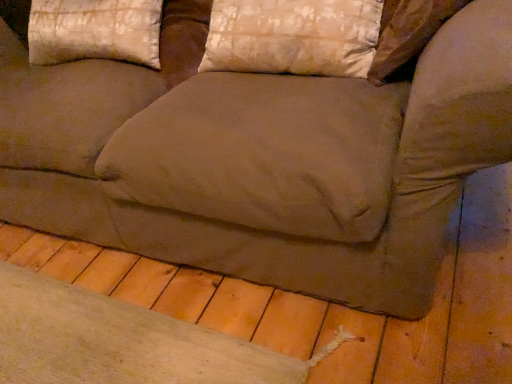
Question: Can you confirm if silky beige pillow at upper center, positioned as the first pillow in right-to-left order, is positioned to the left of silky beige pillow at upper left, arranged as the 2th pillow when viewed from the right?

Choices:
 (A) yes
 (B) no

Answer: (B)

Question: Considering the relative sizes of silky beige pillow at upper center, positioned as the first pillow in right-to-left order, and silky beige pillow at upper left, positioned as the 1th pillow in left-to-right order, in the image provided, is silky beige pillow at upper center, positioned as the first pillow in right-to-left order, shorter than silky beige pillow at upper left, positioned as the 1th pillow in left-to-right order,?

Choices:
 (A) no
 (B) yes

Answer: (B)

Question: Is silky beige pillow at upper center, which is the second pillow from left to right, behind silky beige pillow at upper left, arranged as the 2th pillow when viewed from the right?

Choices:
 (A) no
 (B) yes

Answer: (A)

Question: From a real-world perspective, is silky beige pillow at upper center, positioned as the first pillow in right-to-left order, located beneath silky beige pillow at upper left, arranged as the 2th pillow when viewed from the right?

Choices:
 (A) no
 (B) yes

Answer: (B)

Question: Could you tell me if silky beige pillow at upper center, which is the second pillow from left to right, is facing silky beige pillow at upper left, positioned as the 1th pillow in left-to-right order?

Choices:
 (A) yes
 (B) no

Answer: (B)

Question: Is silky beige pillow at upper center, which is the second pillow from left to right, looking in the opposite direction of silky beige pillow at upper left, arranged as the 2th pillow when viewed from the right?

Choices:
 (A) yes
 (B) no

Answer: (B)

Question: Considering the relative sizes of silky beige pillow at upper left, arranged as the 2th pillow when viewed from the right, and silky beige pillow at upper center, which is the second pillow from left to right, in the image provided, is silky beige pillow at upper left, arranged as the 2th pillow when viewed from the right, smaller than silky beige pillow at upper center, which is the second pillow from left to right,?

Choices:
 (A) yes
 (B) no

Answer: (B)

Question: Is silky beige pillow at upper left, positioned as the 1th pillow in left-to-right order, oriented away from silky beige pillow at upper center, which is the second pillow from left to right?

Choices:
 (A) yes
 (B) no

Answer: (B)

Question: Considering the relative sizes of silky beige pillow at upper left, positioned as the 1th pillow in left-to-right order, and silky beige pillow at upper center, positioned as the first pillow in right-to-left order, in the image provided, is silky beige pillow at upper left, positioned as the 1th pillow in left-to-right order, wider than silky beige pillow at upper center, positioned as the first pillow in right-to-left order,?

Choices:
 (A) no
 (B) yes

Answer: (B)

Question: Could you tell me if silky beige pillow at upper left, arranged as the 2th pillow when viewed from the right, is turned towards silky beige pillow at upper center, positioned as the first pillow in right-to-left order?

Choices:
 (A) yes
 (B) no

Answer: (B)

Question: Is silky beige pillow at upper left, positioned as the 1th pillow in left-to-right order, directly adjacent to silky beige pillow at upper center, positioned as the first pillow in right-to-left order?

Choices:
 (A) no
 (B) yes

Answer: (A)

Question: Is silky beige pillow at upper left, positioned as the 1th pillow in left-to-right order, not inside silky beige pillow at upper center, positioned as the first pillow in right-to-left order?

Choices:
 (A) no
 (B) yes

Answer: (B)

Question: Is silky beige pillow at upper left, arranged as the 2th pillow when viewed from the right, inside or outside of silky beige pillow at upper center, which is the second pillow from left to right?

Choices:
 (A) inside
 (B) outside

Answer: (B)